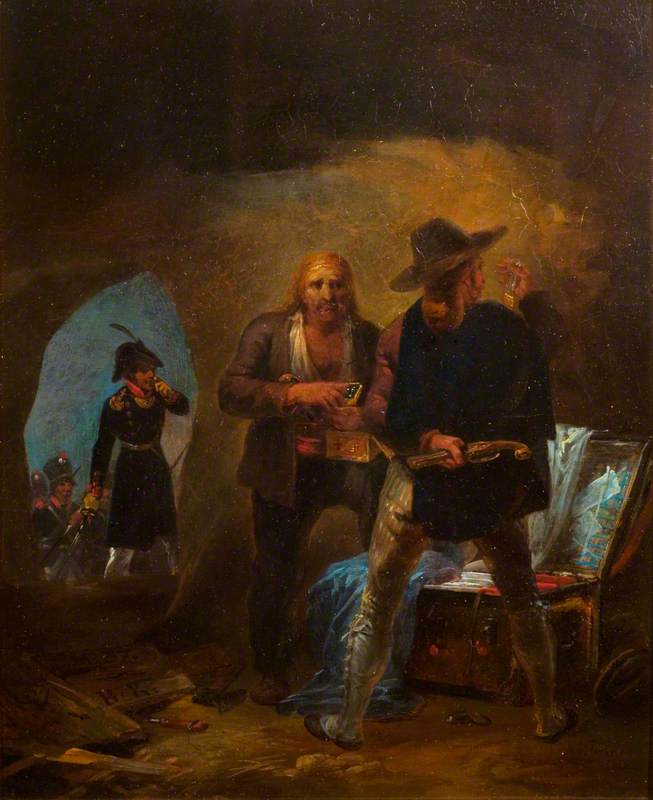
Locate an element on the screen. This screenshot has height=800, width=653. chest is located at coordinates (473, 632).